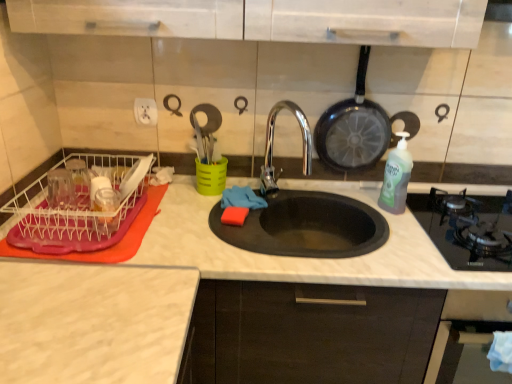
Where is `vacant area that is in front of green translucent bottle at right`? Image resolution: width=512 pixels, height=384 pixels. vacant area that is in front of green translucent bottle at right is located at coordinates (402, 232).